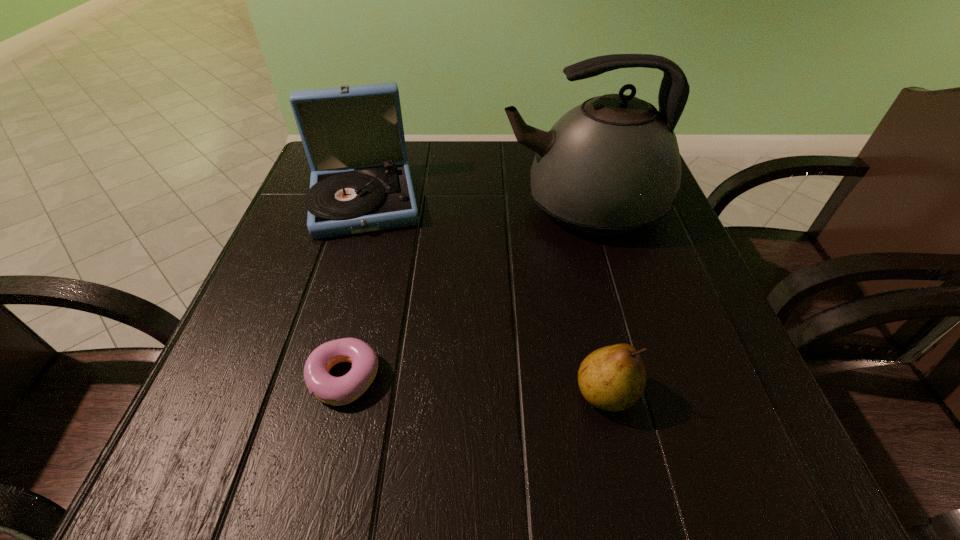
Locate an element on the screen. This screenshot has height=540, width=960. the tallest object is located at coordinates (609, 166).

Locate an element on the screen. This screenshot has height=540, width=960. the second tallest object is located at coordinates (353, 136).

Where is `pear`? Image resolution: width=960 pixels, height=540 pixels. pear is located at coordinates (612, 378).

At what (x,y) coordinates should I click in order to perform the action: click on the shortest object. Please return your answer as a coordinate pair (x, y). Image resolution: width=960 pixels, height=540 pixels. Looking at the image, I should click on (337, 391).

Locate an element on the screen. This screenshot has height=540, width=960. free region located at the spout of the tallest object is located at coordinates (315, 206).

Where is `vacant area situated at the spout of the tallest object`? The width and height of the screenshot is (960, 540). vacant area situated at the spout of the tallest object is located at coordinates (403, 206).

You are a GUI agent. You are given a task and a screenshot of the screen. Output one action in this format:
    pyautogui.click(x=<x>, y=<y>)
    Task: Click on the vacant space located 0.310m at the spout of the tallest object
    
    Given the screenshot: What is the action you would take?
    pyautogui.click(x=356, y=206)

You are a GUI agent. You are given a task and a screenshot of the screen. Output one action in this format:
    pyautogui.click(x=<x>, y=<y>)
    Task: Click on the vacant position located on the front of the phonograph record
    The height and width of the screenshot is (540, 960).
    Given the screenshot: What is the action you would take?
    pos(317,355)

You are a GUI agent. You are given a task and a screenshot of the screen. Output one action in this format:
    pyautogui.click(x=<x>, y=<y>)
    Task: Click on the vacant space positioned 0.080m on the front of the third tallest object
    The height and width of the screenshot is (540, 960).
    Given the screenshot: What is the action you would take?
    pyautogui.click(x=626, y=482)

Where is `free spot located on the right of the doughnut`? Image resolution: width=960 pixels, height=540 pixels. free spot located on the right of the doughnut is located at coordinates (440, 377).